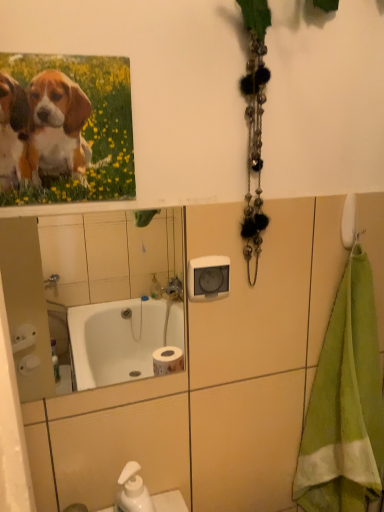
Question: Does green terry cloth towel at right have a larger size compared to white glossy mirror at upper center?

Choices:
 (A) yes
 (B) no

Answer: (A)

Question: Is green terry cloth towel at right in front of white glossy mirror at upper center?

Choices:
 (A) yes
 (B) no

Answer: (B)

Question: Can you confirm if green terry cloth towel at right is positioned to the left of white glossy mirror at upper center?

Choices:
 (A) yes
 (B) no

Answer: (B)

Question: From the image's perspective, is green terry cloth towel at right above white glossy mirror at upper center?

Choices:
 (A) yes
 (B) no

Answer: (B)

Question: Does green terry cloth towel at right have a lesser width compared to white glossy mirror at upper center?

Choices:
 (A) no
 (B) yes

Answer: (A)

Question: From the image's perspective, is green terry cloth towel at right below white glossy mirror at upper center?

Choices:
 (A) yes
 (B) no

Answer: (A)

Question: Is white glossy mirror at upper center wider than green terry cloth towel at right?

Choices:
 (A) yes
 (B) no

Answer: (B)

Question: Does white glossy mirror at upper center have a larger size compared to green terry cloth towel at right?

Choices:
 (A) yes
 (B) no

Answer: (B)

Question: From the image's perspective, is white glossy mirror at upper center on green terry cloth towel at right?

Choices:
 (A) yes
 (B) no

Answer: (A)

Question: Is white glossy mirror at upper center positioned in front of green terry cloth towel at right?

Choices:
 (A) no
 (B) yes

Answer: (B)

Question: Does white glossy mirror at upper center have a greater height compared to green terry cloth towel at right?

Choices:
 (A) yes
 (B) no

Answer: (B)

Question: Is white glossy mirror at upper center far from green terry cloth towel at right?

Choices:
 (A) yes
 (B) no

Answer: (A)

Question: From a real-world perspective, is white glossy mirror at upper center below matte canvas print of puppies at upper left?

Choices:
 (A) no
 (B) yes

Answer: (B)